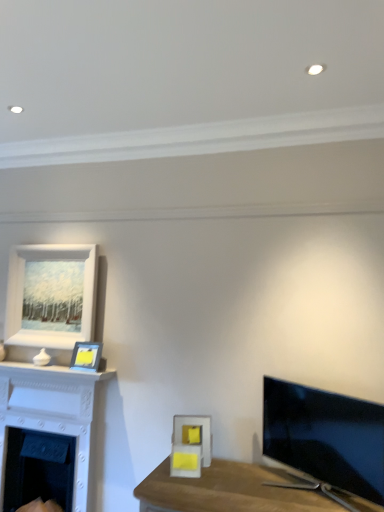
Question: From the image's perspective, relative to matte yellow picture frame at center, the third picture frame in the left-to-right sequence, is matte yellow picture frame at upper left, which is the 2th picture frame in front-to-back order, above or below?

Choices:
 (A) above
 (B) below

Answer: (A)

Question: Do you think matte yellow picture frame at upper left, the second picture frame from the back, is within matte yellow picture frame at center, the third picture frame in the left-to-right sequence, or outside of it?

Choices:
 (A) inside
 (B) outside

Answer: (B)

Question: Which is nearer to the matte yellow picture frame at center, the third picture frame in the left-to-right sequence?

Choices:
 (A) white matte picture frame at upper left, the first picture frame from the left
 (B) matte yellow picture frame at upper left, the second picture frame from the back
 (C) white glossy fireplace at left, the second fireplace when ordered from bottom to top
 (D) white matte fireplace at lower left, placed as the second fireplace when sorted from top to bottom
 (E) satin black tv at right

Answer: (E)

Question: Which of these objects is positioned closest to the white glossy fireplace at left, placed as the 1th fireplace when sorted from top to bottom?

Choices:
 (A) white matte fireplace at lower left, placed as the second fireplace when sorted from top to bottom
 (B) satin black tv at right
 (C) matte yellow picture frame at upper left, the second picture frame from the right
 (D) matte yellow picture frame at center, the 1th picture frame viewed from the front
 (E) white matte picture frame at upper left, the first picture frame from the left

Answer: (A)